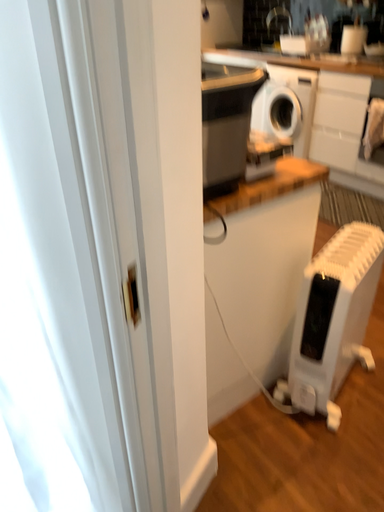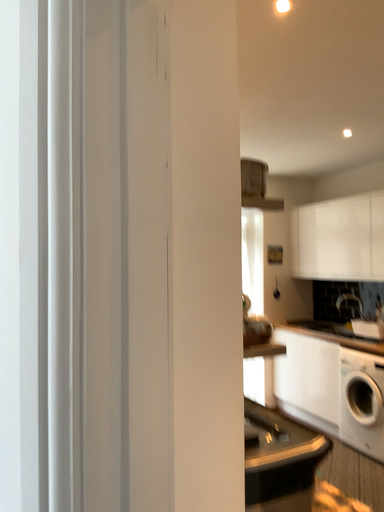
Question: How did the camera likely rotate when shooting the video?

Choices:
 (A) rotated right
 (B) rotated left

Answer: (B)